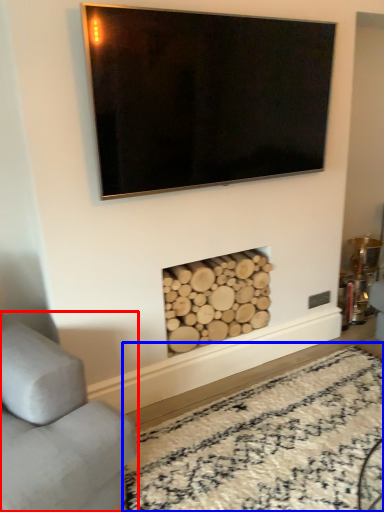
Question: Which object is further to the camera taking this photo, studio couch (highlighted by a red box) or plain (highlighted by a blue box)?

Choices:
 (A) studio couch
 (B) plain

Answer: (B)